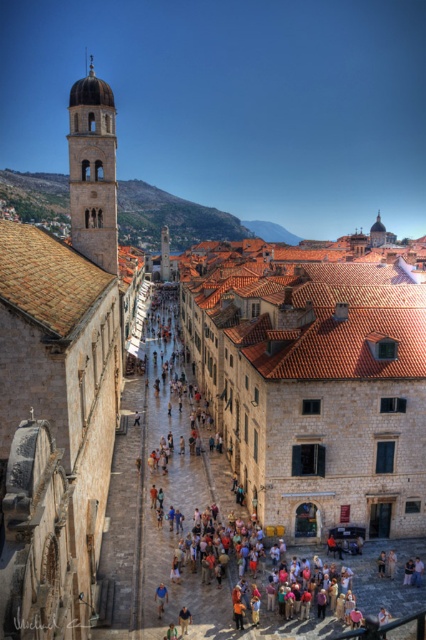
Is blue fabric shirt at center above light brown leather jacket at center?

Yes.

Between blue fabric shirt at center and light brown leather jacket at center, which one appears on the left side from the viewer's perspective?

blue fabric shirt at center

Who is more distant from viewer, (161, 614) or (189, 624)?

The point (161, 614) is more distant.

Identify the location of blue fabric shirt at center. The height and width of the screenshot is (640, 426). (161, 598).

Can you confirm if matte stone tower at upper left is taller than smooth stone tower at center?

No, matte stone tower at upper left is not taller than smooth stone tower at center.

Between matte stone tower at upper left and smooth stone tower at center, which one appears on the right side from the viewer's perspective?

From the viewer's perspective, matte stone tower at upper left appears more on the right side.

What do you see at coordinates (92, 170) in the screenshot? I see `matte stone tower at upper left` at bounding box center [92, 170].

Locate an element on the screen. Image resolution: width=426 pixels, height=640 pixels. matte stone tower at upper left is located at coordinates (92, 170).

Does smooth stone tower at center have a lesser width compared to blue fabric shirt at center?

No.

Does point (163, 232) come farther from viewer compared to point (164, 589)?

Yes, point (163, 232) is behind point (164, 589).

I want to click on smooth stone tower at center, so click(x=164, y=253).